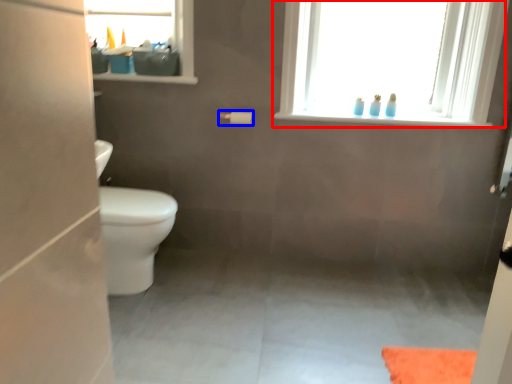
Question: Among these objects, which one is nearest to the camera, window (highlighted by a red box) or toilet paper (highlighted by a blue box)?

Choices:
 (A) window
 (B) toilet paper

Answer: (A)